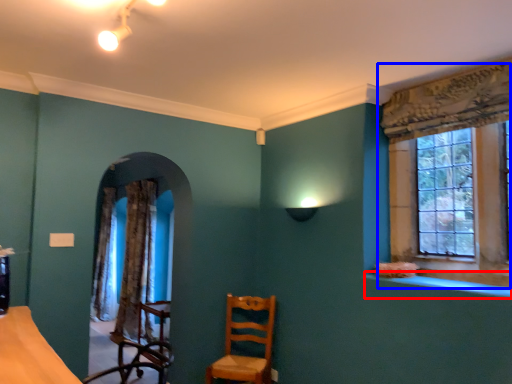
Question: Which of the following is the farthest to the observer, window sill (highlighted by a red box) or window (highlighted by a blue box)?

Choices:
 (A) window sill
 (B) window

Answer: (B)